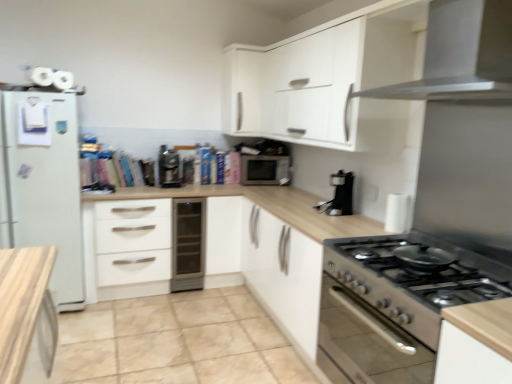
Question: Would you say white matte cabinet at upper center is inside or outside satin black coffee machine at center, the second coffee machine in the front-to-back sequence?

Choices:
 (A) inside
 (B) outside

Answer: (B)

Question: Is white matte cabinet at upper center in front of or behind satin black coffee machine at center, marked as the first coffee machine in a left-to-right arrangement, in the image?

Choices:
 (A) front
 (B) behind

Answer: (B)

Question: Estimate the real-world distances between objects in this image. Which object is closer to the satin black coffee machine at center, the second coffee machine in the front-to-back sequence?

Choices:
 (A) beige tile at lower center
 (B) stainless steel stove at lower right, the 1th kitchen appliance positioned from the bottom
 (C) satin silver dishwasher at center
 (D) satin silver microwave at upper center
 (E) white matte drawer at center

Answer: (C)

Question: Which object is positioned closest to the white matte drawer at center?

Choices:
 (A) satin silver dishwasher at center
 (B) satin silver range hood at upper right, arranged as the 1th kitchen appliance when viewed from the top
 (C) stainless steel stove at lower right, the second kitchen appliance positioned from the top
 (D) satin silver microwave at upper center
 (E) beige tile at lower center

Answer: (A)